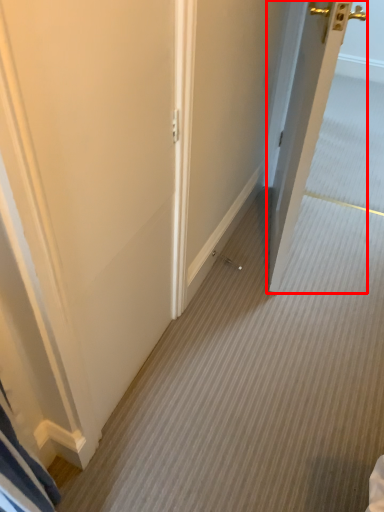
Question: From the image, what is the correct spatial relationship of door (annotated by the red box) in relation to door?

Choices:
 (A) right
 (B) left

Answer: (A)